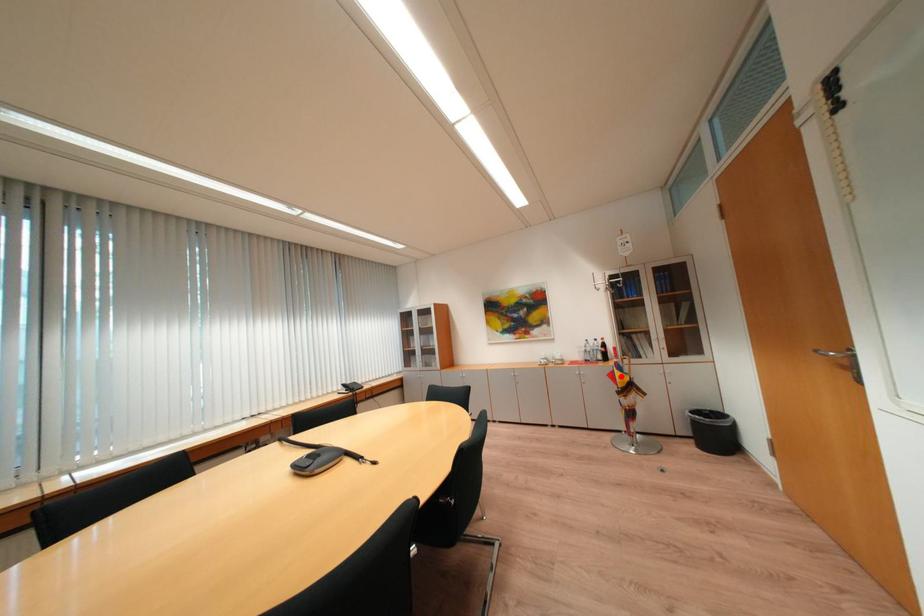
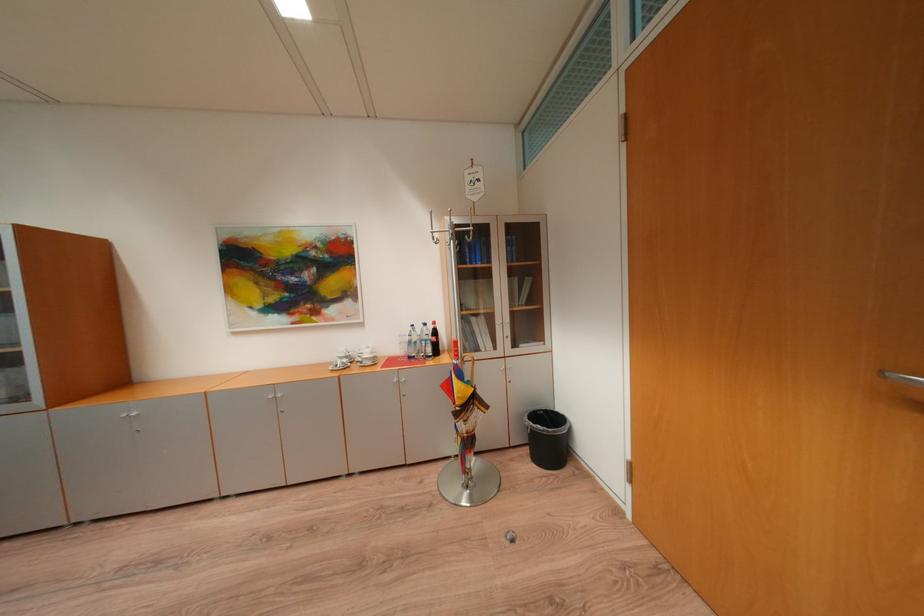
Question: I am providing you with two images of the same scene from different viewpoints. Given a red point in image1, look at the same physical point in image2. Is it:

Choices:
 (A) Closer to the viewpoint
 (B) Farther from the viewpoint

Answer: (B)